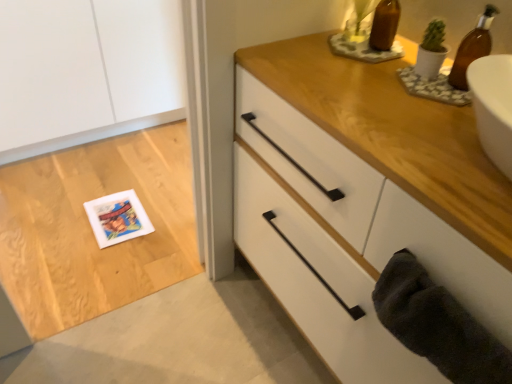
Locate an element on the screen. This screenshot has width=512, height=384. free space in front of brown glass bottle at upper right is located at coordinates (445, 125).